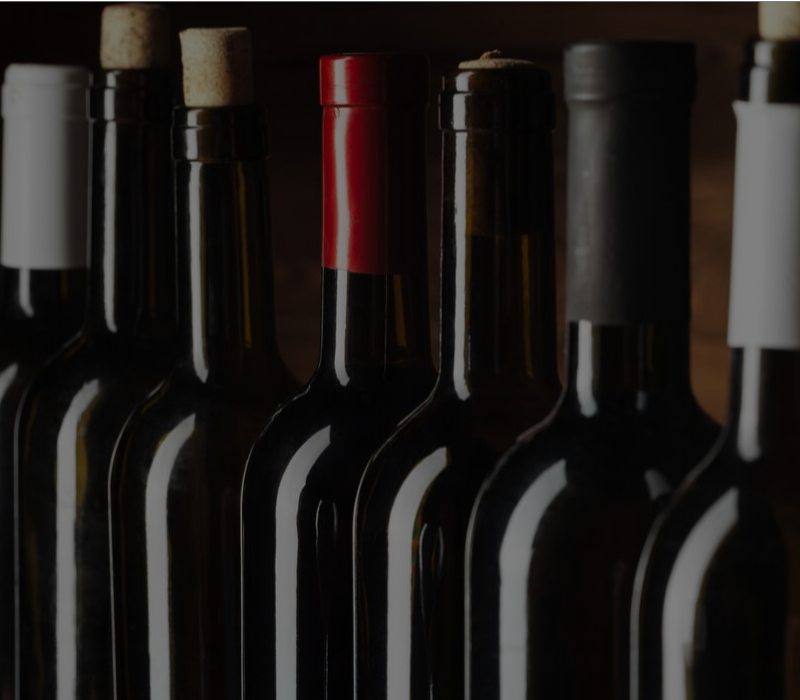
Locate an element on the screen. This screenshot has width=800, height=700. corks is located at coordinates (778, 24), (500, 60), (214, 71), (128, 46).